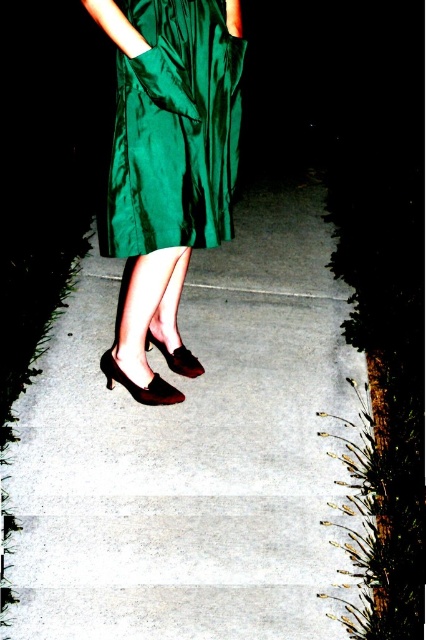
Question: Which point is farther to the camera?

Choices:
 (A) smooth concrete pavement at center
 (B) shiny black leather high-heeled shoe at center

Answer: (B)

Question: Among these objects, which one is farthest from the camera?

Choices:
 (A) suede-like brown sandal at center
 (B) smooth concrete pavement at center

Answer: (A)

Question: Which object appears closest to the camera in this image?

Choices:
 (A) suede-like brown sandal at center
 (B) smooth concrete pavement at center
 (C) shiny green dress at center

Answer: (B)

Question: Can you confirm if shiny green dress at center is bigger than shiny black leather high-heeled shoe at center?

Choices:
 (A) yes
 (B) no

Answer: (A)

Question: Where is shiny green dress at center located in relation to shiny black leather high-heeled shoe at center in the image?

Choices:
 (A) below
 (B) above

Answer: (B)

Question: Is shiny black leather high-heeled shoe at center in front of suede-like brown sandal at center?

Choices:
 (A) yes
 (B) no

Answer: (A)